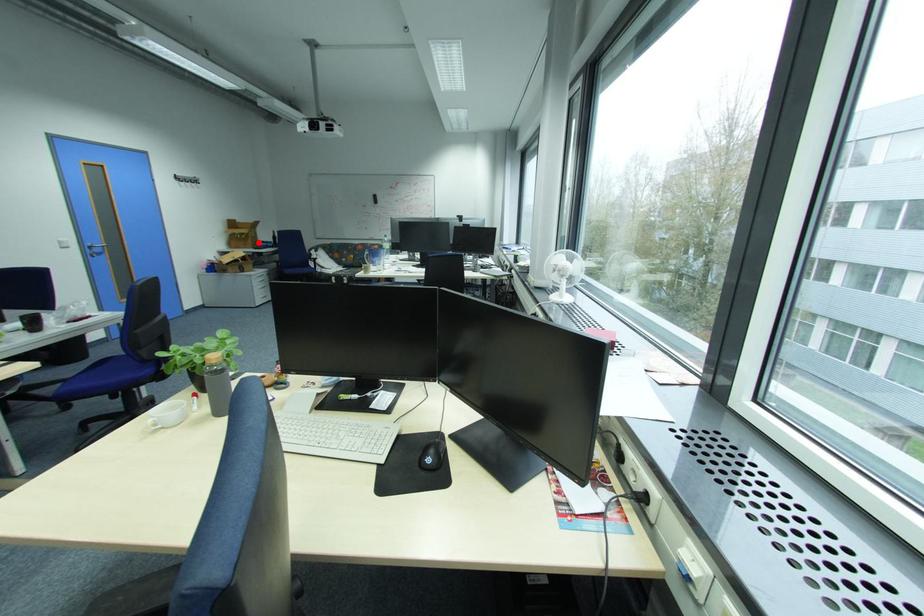
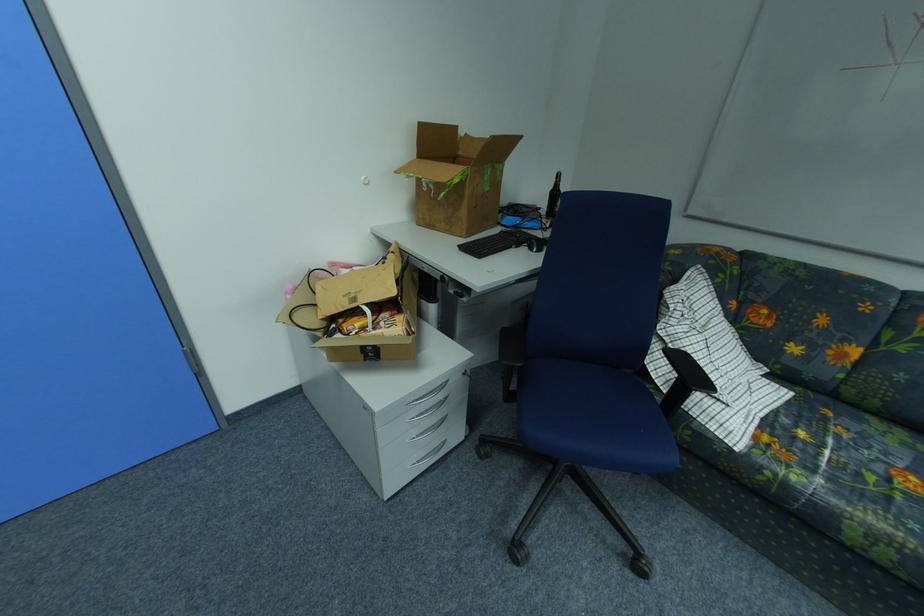
Locate, in the second image, the point that corresponds to the highlighted location in the first image.

(470, 214)